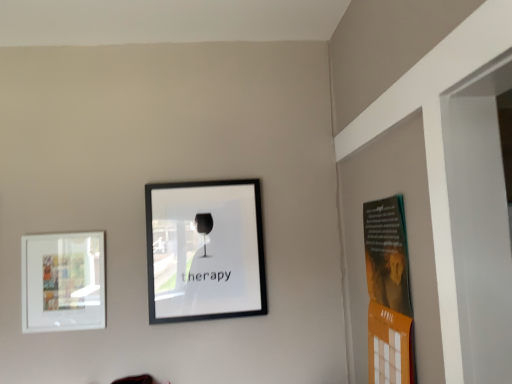
Question: Can you confirm if white matte picture frame at left, acting as the second picture frame starting from the right, is wider than black matte picture frame at center, the 2th picture frame positioned from the left?

Choices:
 (A) yes
 (B) no

Answer: (B)

Question: Does white matte picture frame at left, acting as the second picture frame starting from the right, have a lesser width compared to black matte picture frame at center, acting as the first picture frame starting from the right?

Choices:
 (A) no
 (B) yes

Answer: (B)

Question: Does white matte picture frame at left, acting as the second picture frame starting from the right, have a smaller size compared to black matte picture frame at center, the 2th picture frame positioned from the left?

Choices:
 (A) no
 (B) yes

Answer: (B)

Question: From the image's perspective, is white matte picture frame at left, positioned as the first picture frame in left-to-right order, over black matte picture frame at center, acting as the first picture frame starting from the right?

Choices:
 (A) no
 (B) yes

Answer: (A)

Question: From a real-world perspective, is white matte picture frame at left, positioned as the first picture frame in left-to-right order, physically below black matte picture frame at center, acting as the first picture frame starting from the right?

Choices:
 (A) yes
 (B) no

Answer: (A)

Question: Would you consider white matte picture frame at left, acting as the second picture frame starting from the right, to be distant from black matte picture frame at center, acting as the first picture frame starting from the right?

Choices:
 (A) no
 (B) yes

Answer: (A)

Question: From a real-world perspective, is black matte picture frame at center, the 2th picture frame positioned from the left, positioned under white matte picture frame at left, positioned as the first picture frame in left-to-right order, based on gravity?

Choices:
 (A) no
 (B) yes

Answer: (A)

Question: Is black matte picture frame at center, acting as the first picture frame starting from the right, looking in the opposite direction of white matte picture frame at left, acting as the second picture frame starting from the right?

Choices:
 (A) yes
 (B) no

Answer: (B)

Question: Considering the relative positions of black matte picture frame at center, the 2th picture frame positioned from the left, and white matte picture frame at left, positioned as the first picture frame in left-to-right order, in the image provided, is black matte picture frame at center, the 2th picture frame positioned from the left, to the right of white matte picture frame at left, positioned as the first picture frame in left-to-right order, from the viewer's perspective?

Choices:
 (A) yes
 (B) no

Answer: (A)

Question: From a real-world perspective, is black matte picture frame at center, the 2th picture frame positioned from the left, positioned over white matte picture frame at left, acting as the second picture frame starting from the right, based on gravity?

Choices:
 (A) yes
 (B) no

Answer: (A)

Question: Can you confirm if black matte picture frame at center, the 2th picture frame positioned from the left, is bigger than white matte picture frame at left, positioned as the first picture frame in left-to-right order?

Choices:
 (A) no
 (B) yes

Answer: (B)

Question: Can you confirm if black matte picture frame at center, the 2th picture frame positioned from the left, is taller than white matte picture frame at left, acting as the second picture frame starting from the right?

Choices:
 (A) yes
 (B) no

Answer: (A)

Question: From a real-world perspective, is black matte picture frame at center, the 2th picture frame positioned from the left, physically located above or below white matte picture frame at left, positioned as the first picture frame in left-to-right order?

Choices:
 (A) below
 (B) above

Answer: (B)